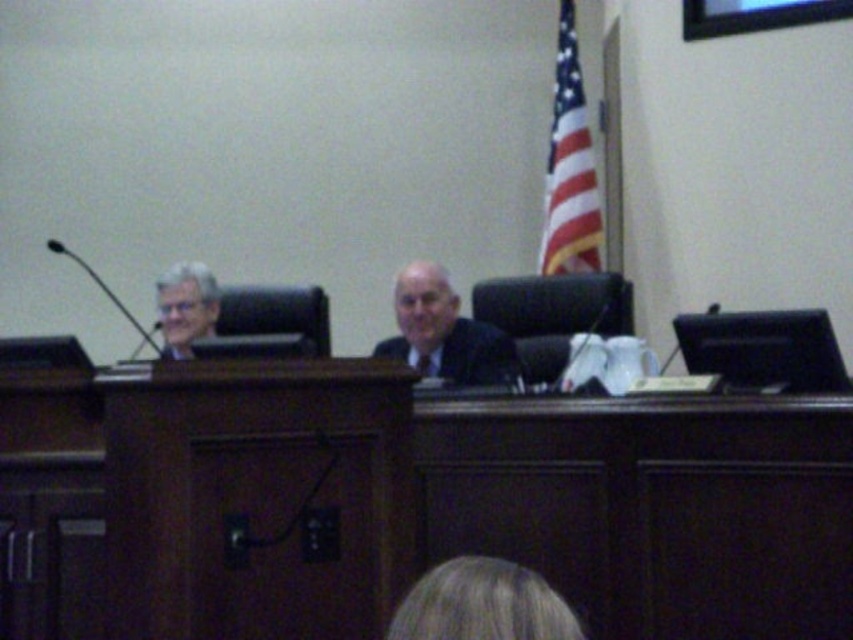
Does matte black suit at center appear under matte black suit at left?

Correct, matte black suit at center is located below matte black suit at left.

Can you confirm if matte black suit at center is taller than matte black suit at left?

Yes, matte black suit at center is taller than matte black suit at left.

Describe the element at coordinates (444, 332) in the screenshot. The height and width of the screenshot is (640, 853). I see `matte black suit at center` at that location.

Image resolution: width=853 pixels, height=640 pixels. Find the location of `matte black suit at center`. matte black suit at center is located at coordinates (444, 332).

In the scene shown: Can you confirm if blonde hair at lower center is bigger than matte black suit at center?

No.

Image resolution: width=853 pixels, height=640 pixels. What are the coordinates of `blonde hair at lower center` in the screenshot? It's located at (482, 604).

Who is more forward, (422, 593) or (177, 276)?

Point (422, 593)

Is blonde hair at lower center below matte black suit at left?

Correct, blonde hair at lower center is located below matte black suit at left.

Does point (469, 593) come farther from viewer compared to point (190, 262)?

That is False.

At what (x,y) coordinates should I click in order to perform the action: click on blonde hair at lower center. Please return your answer as a coordinate pair (x, y). Looking at the image, I should click on (482, 604).